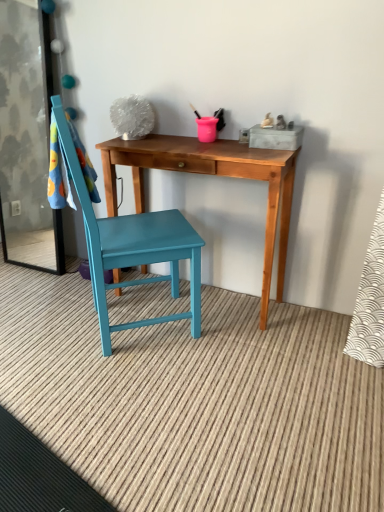
Question: Does wooden desk at center have a smaller size compared to teal painted wood chair at center?

Choices:
 (A) yes
 (B) no

Answer: (A)

Question: From the image's perspective, would you say wooden desk at center is positioned over teal painted wood chair at center?

Choices:
 (A) no
 (B) yes

Answer: (A)

Question: Considering the relative positions of wooden desk at center and teal painted wood chair at center in the image provided, is wooden desk at center to the right of teal painted wood chair at center from the viewer's perspective?

Choices:
 (A) yes
 (B) no

Answer: (A)

Question: From the image's perspective, is wooden desk at center beneath teal painted wood chair at center?

Choices:
 (A) yes
 (B) no

Answer: (A)

Question: Can we say wooden desk at center lies outside teal painted wood chair at center?

Choices:
 (A) yes
 (B) no

Answer: (A)

Question: Is teal painted wood chair at center surrounded by wooden desk at center?

Choices:
 (A) no
 (B) yes

Answer: (A)

Question: Considering the relative sizes of transparent glass screen door at left and wooden desk at center in the image provided, is transparent glass screen door at left wider than wooden desk at center?

Choices:
 (A) yes
 (B) no

Answer: (B)

Question: From the image's perspective, is transparent glass screen door at left on wooden desk at center?

Choices:
 (A) no
 (B) yes

Answer: (B)

Question: Is wooden desk at center located within transparent glass screen door at left?

Choices:
 (A) yes
 (B) no

Answer: (B)

Question: Is the surface of transparent glass screen door at left in direct contact with wooden desk at center?

Choices:
 (A) yes
 (B) no

Answer: (B)

Question: Does transparent glass screen door at left appear on the right side of wooden desk at center?

Choices:
 (A) yes
 (B) no

Answer: (B)

Question: Is transparent glass screen door at left located outside wooden desk at center?

Choices:
 (A) no
 (B) yes

Answer: (B)

Question: Considering the relative positions of wooden desk at center and transparent glass screen door at left in the image provided, is wooden desk at center to the right of transparent glass screen door at left from the viewer's perspective?

Choices:
 (A) no
 (B) yes

Answer: (B)